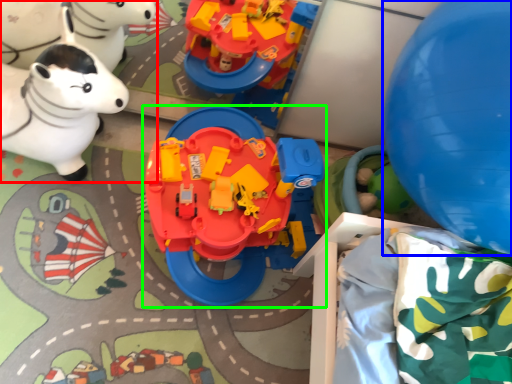
Question: Based on their relative distances, which object is farther from toy (highlighted by a red box)? Choose from balloon (highlighted by a blue box) and toy (highlighted by a green box).

Choices:
 (A) balloon
 (B) toy

Answer: (A)